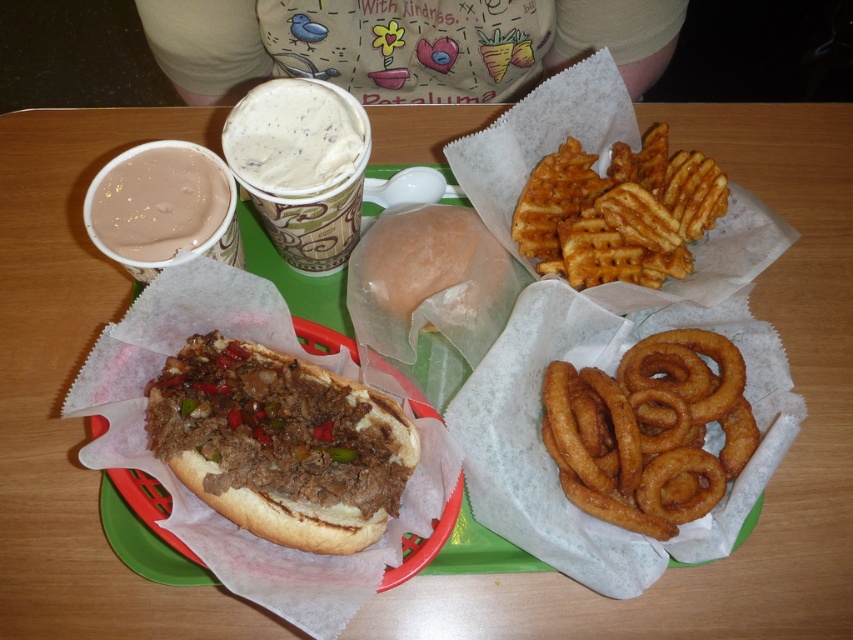
Question: Can you confirm if brown breaded meat at lower left is positioned above light brown creamy cup at center?

Choices:
 (A) no
 (B) yes

Answer: (A)

Question: Which point is closer to the camera?

Choices:
 (A) (303, 108)
 (B) (181, 216)
 (C) (358, 531)

Answer: (C)

Question: Can you confirm if brown breaded meat at lower left is smaller than light brown creamy cup at center?

Choices:
 (A) no
 (B) yes

Answer: (A)

Question: Which is farther from the light brown creamy cup at center?

Choices:
 (A) brown breaded meat at lower left
 (B) smooth chocolate milkshake at upper left

Answer: (A)

Question: Is brown breaded meat at lower left below light brown creamy cup at center?

Choices:
 (A) yes
 (B) no

Answer: (A)

Question: Considering the real-world distances, which object is farthest from the light brown creamy cup at center?

Choices:
 (A) brown breaded meat at lower left
 (B) smooth chocolate milkshake at upper left

Answer: (A)